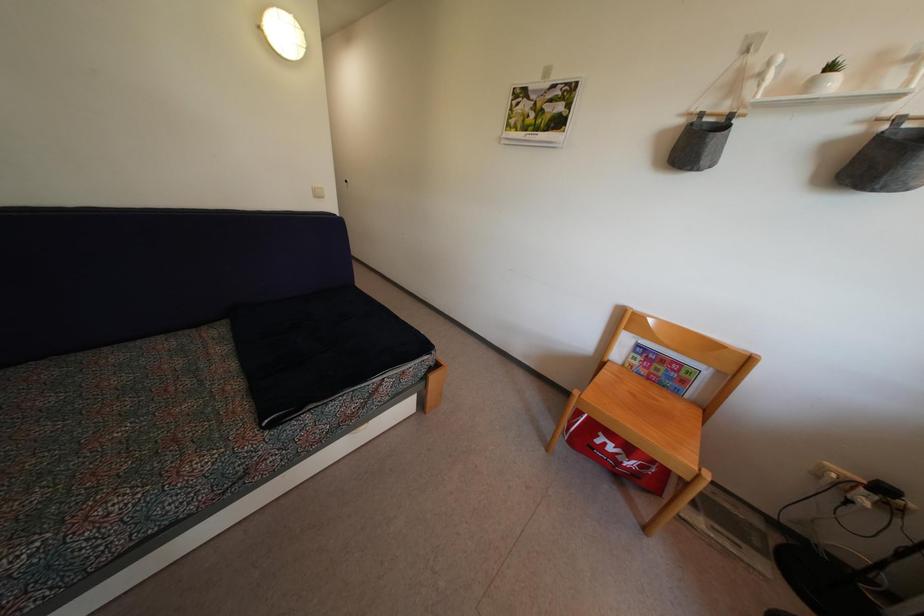
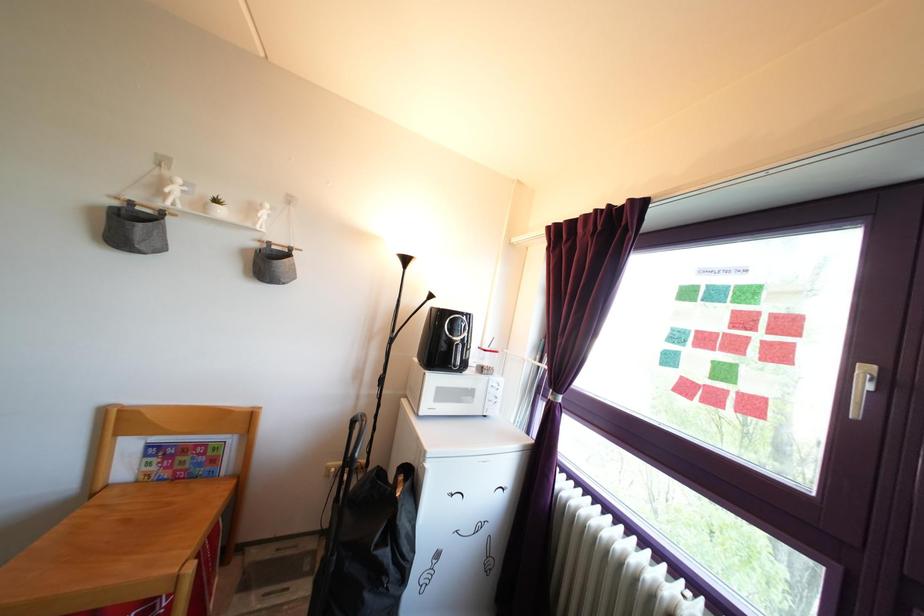
In the second image, find the point that corresponds to [685,129] in the first image.

(118, 211)